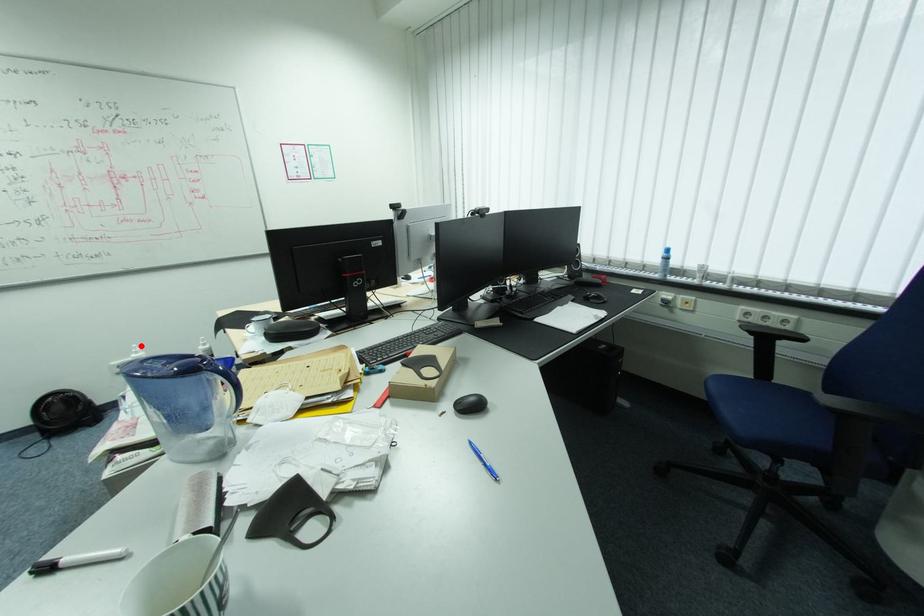
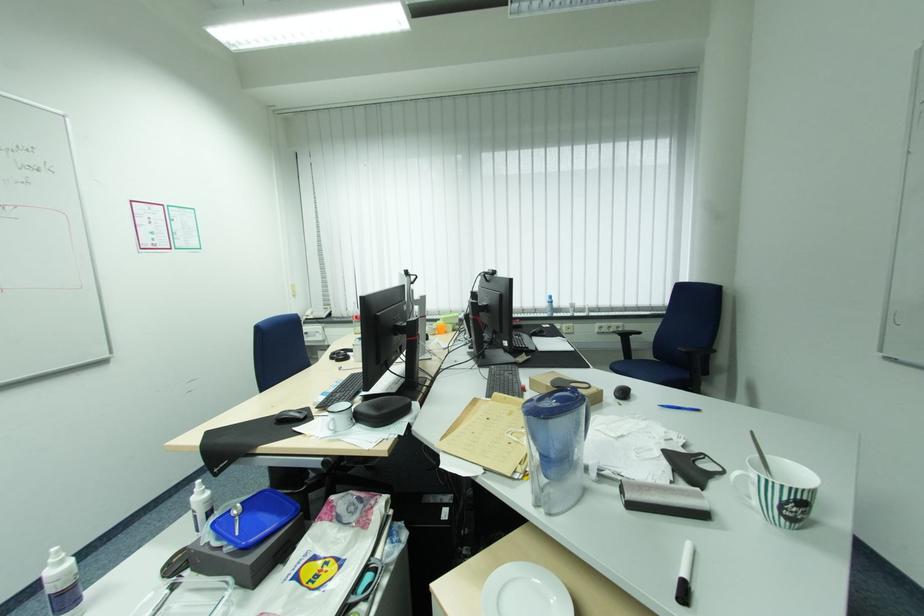
Find the pixel in the second image that matches the highlighted location in the first image.

(62, 548)